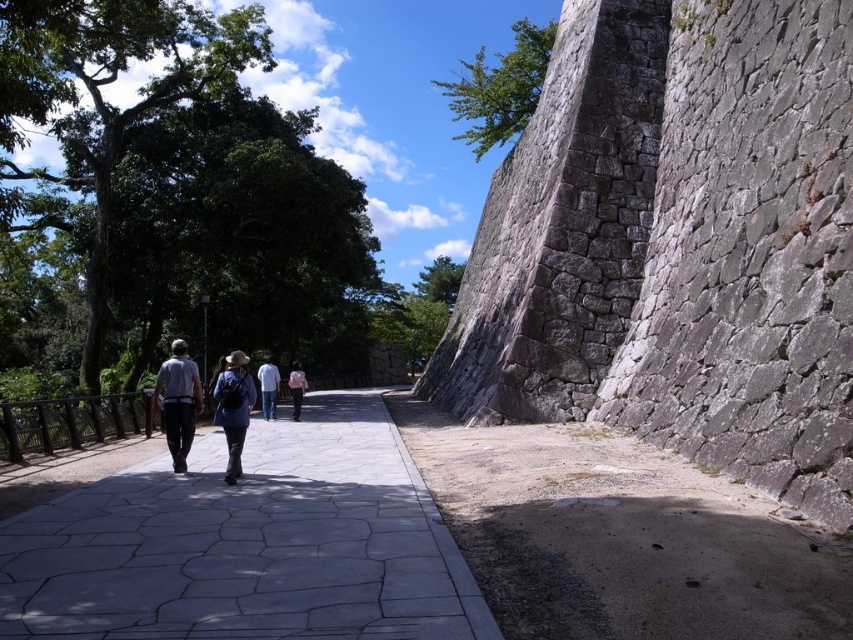
Question: Which is farther from the blue fabric backpack at center?

Choices:
 (A) light gray cotton shirt at center
 (B) pink fabric shirt at center
 (C) white cotton shirt at center

Answer: (C)

Question: From the image, what is the correct spatial relationship of gray stone pavement at center in relation to pink fabric shirt at center?

Choices:
 (A) left
 (B) right

Answer: (B)

Question: Is light gray cotton shirt at center to the right of pink fabric shirt at center from the viewer's perspective?

Choices:
 (A) yes
 (B) no

Answer: (A)

Question: Which point is farther from the camera taking this photo?

Choices:
 (A) (299, 394)
 (B) (231, 456)
 (C) (293, 605)

Answer: (A)

Question: Which point is farther to the camera?

Choices:
 (A) blue fabric backpack at center
 (B) gray stone pavement at center

Answer: (A)

Question: Does denim jacket at center have a larger size compared to blue fabric backpack at center?

Choices:
 (A) no
 (B) yes

Answer: (B)